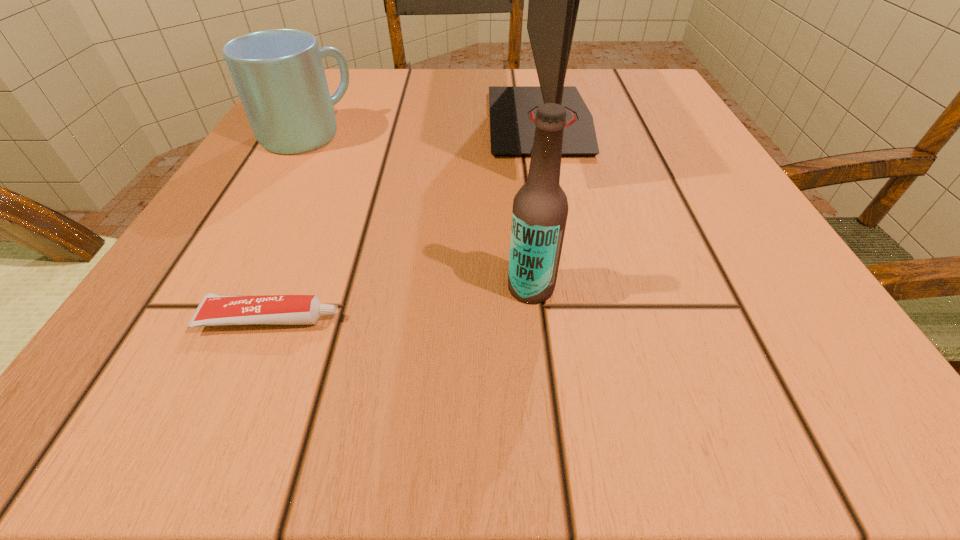
Locate an element on the screen. The width and height of the screenshot is (960, 540). monitor is located at coordinates (554, 0).

At what (x,y) coordinates should I click in order to perform the action: click on the second tallest object. Please return your answer as a coordinate pair (x, y). Looking at the image, I should click on (540, 208).

Identify the location of mug. The image size is (960, 540). (279, 75).

What are the coordinates of `toothpaste` in the screenshot? It's located at click(x=214, y=309).

Where is `vacant point located on the screen side of the monitor`? This screenshot has width=960, height=540. vacant point located on the screen side of the monitor is located at coordinates (334, 122).

Locate an element on the screen. This screenshot has width=960, height=540. vacant region located 0.220m on the screen side of the monitor is located at coordinates (367, 122).

Locate an element on the screen. blank space located on the screen side of the monitor is located at coordinates (445, 122).

Where is `vacant area situated 0.250m on the side of the third shortest object with the label`? This screenshot has height=540, width=960. vacant area situated 0.250m on the side of the third shortest object with the label is located at coordinates (292, 288).

At what (x,y) coordinates should I click in order to perform the action: click on free space located on the side of the third shortest object with the label. Please return your answer as a coordinate pair (x, y). The height and width of the screenshot is (540, 960). Looking at the image, I should click on tap(197, 288).

Locate an element on the screen. Image resolution: width=960 pixels, height=540 pixels. free space located 0.320m on the side of the third shortest object with the label is located at coordinates (231, 288).